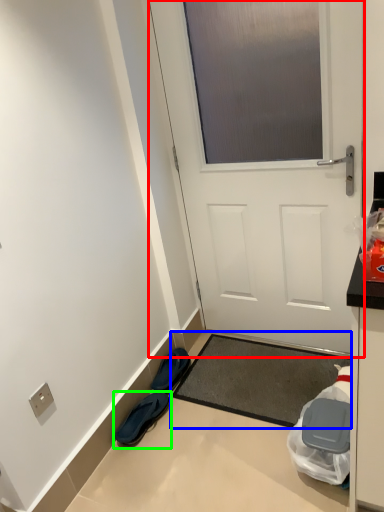
Question: Which object is positioned closest to door (highlighted by a red box)? Select from doormat (highlighted by a blue box) and footwear (highlighted by a green box).

Choices:
 (A) doormat
 (B) footwear

Answer: (A)